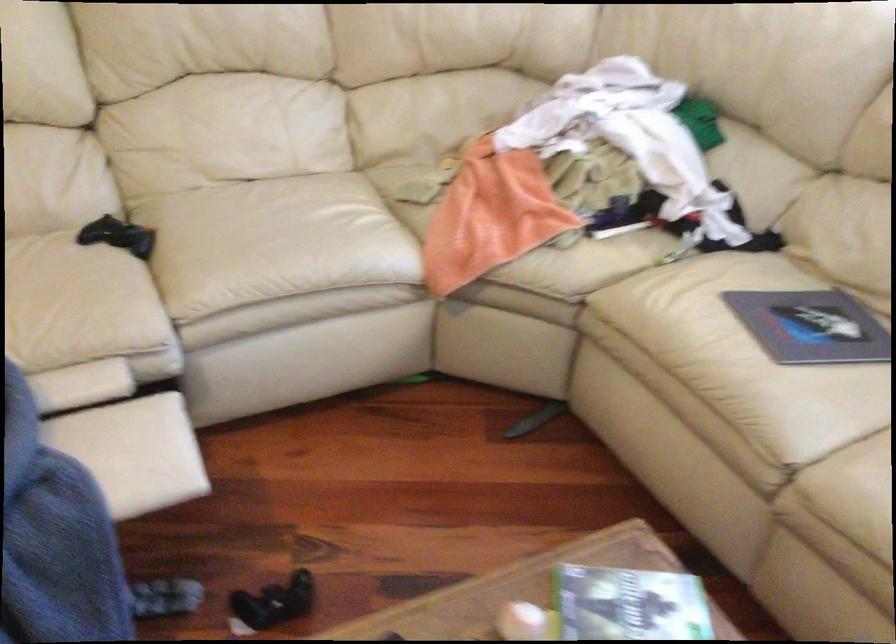
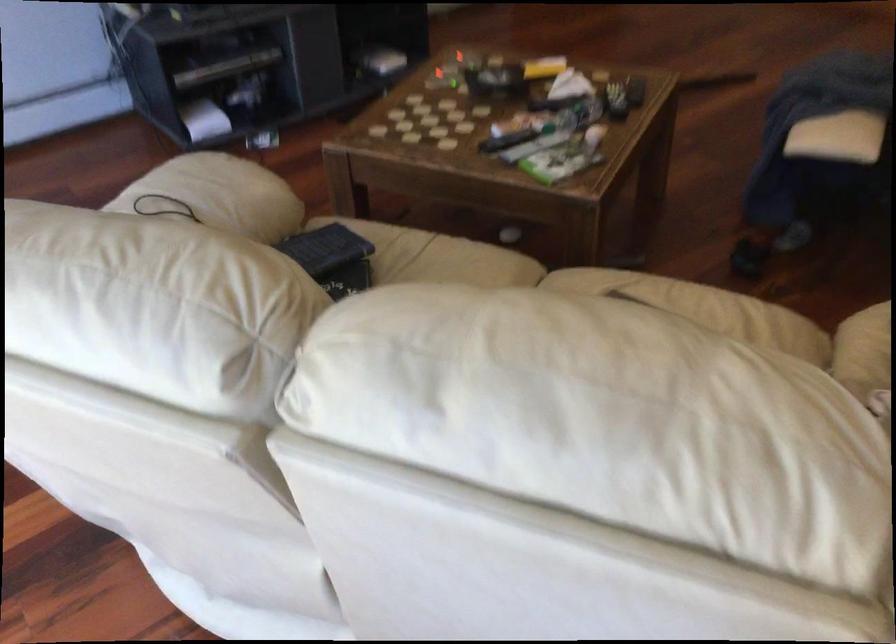
Find the pixel in the second image that matches the point at 615,252 in the first image.

(864, 351)